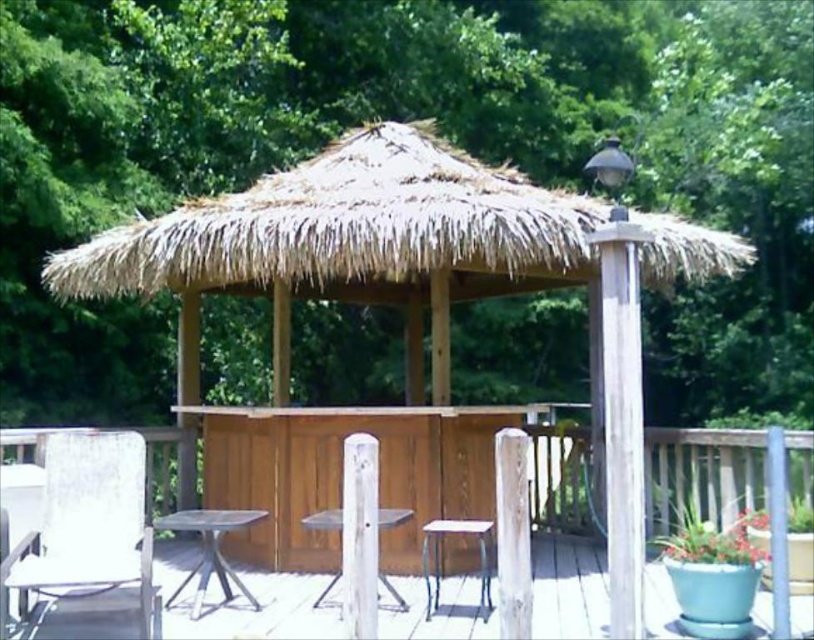
You are setting up a small event and need to place a 1.2 meter wide banner between the metallic silver table at lower left and the wooden table at center. Can the banner fit between them based on their widths?

The metallic silver table at lower left has a lesser width compared to wooden table at center. Since the banner is 1.2 meters wide, it depends on the actual distance between the tables, not just their widths. The question doesn

You are a guest at the tiki bar and want to sit on the metallic silver stool at lower center. Is there anything blocking your path to it from the green leafy tree at upper center?

The green leafy tree at upper center is above the metallic silver stool at lower center, so there is nothing blocking your path to the stool.